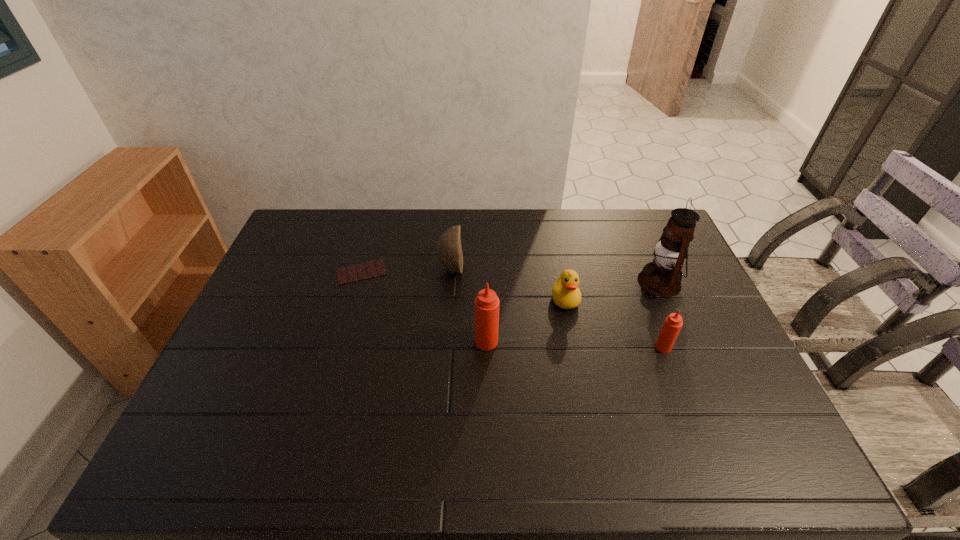
I want to click on free point between the lantern and the chocolate bar, so click(510, 277).

This screenshot has width=960, height=540. I want to click on vacant space that is in between the fifth object from right to left and the fifth tallest object, so coord(508,284).

Locate an element on the screen. free space between the tallest object and the bowl is located at coordinates (555, 275).

The height and width of the screenshot is (540, 960). Find the location of `object that is the fourth closest to the second shortest object`. object that is the fourth closest to the second shortest object is located at coordinates (449, 249).

Identify which object is the fifth nearest to the leftmost object. Please provide its 2D coordinates. Your answer should be formatted as a tuple, i.e. [(x, y)], where the tuple contains the x and y coordinates of a point satisfying the conditions above.

[(673, 323)]

This screenshot has height=540, width=960. Find the location of `free region that satisfies the following two spatial constraints: 1. on the side of the lantern, there is a wick adjustment knob; 2. on the front side of the third object from left to right`. free region that satisfies the following two spatial constraints: 1. on the side of the lantern, there is a wick adjustment knob; 2. on the front side of the third object from left to right is located at coordinates (684, 341).

Where is `vacant space that satisfies the following two spatial constraints: 1. on the side of the tallest object, there is a wick adjustment knob; 2. at the beak of the third object from right to left`? vacant space that satisfies the following two spatial constraints: 1. on the side of the tallest object, there is a wick adjustment knob; 2. at the beak of the third object from right to left is located at coordinates (666, 299).

What are the coordinates of `free space that satisfies the following two spatial constraints: 1. on the back side of the fifth object from right to left; 2. on the left side of the leftmost object` in the screenshot? It's located at (363, 268).

You are a GUI agent. You are given a task and a screenshot of the screen. Output one action in this format:
    pyautogui.click(x=<x>, y=<y>)
    Task: Click on the vacant area in the image that satisfies the following two spatial constraints: 1. at the beak of the right Tabasco sauce; 2. on the right side of the second shortest object
    Image resolution: width=960 pixels, height=540 pixels.
    Given the screenshot: What is the action you would take?
    pyautogui.click(x=575, y=347)

The height and width of the screenshot is (540, 960). I want to click on free spot that satisfies the following two spatial constraints: 1. on the front side of the right Tabasco sauce; 2. on the left side of the leftmost object, so click(339, 347).